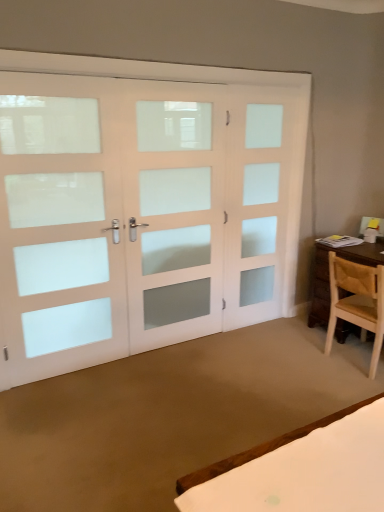
How much space does white frosted glass door at center, placed as the second screen door when sorted from left to right, occupy vertically?

6.43 feet.

What is the approximate height of white frosted glass door at left, positioned as the third screen door in right-to-left order?

white frosted glass door at left, positioned as the third screen door in right-to-left order, is 1.97 meters in height.

What do you see at coordinates (59, 228) in the screenshot? I see `white frosted glass door at left, positioned as the third screen door in right-to-left order` at bounding box center [59, 228].

Locate an element on the screen. The height and width of the screenshot is (512, 384). light brown wooden chair at right is located at coordinates (357, 302).

From a real-world perspective, is white frosted glass door at right, placed as the first screen door when sorted from right to left, below light brown wooden chair at right?

Incorrect, from a real-world perspective, white frosted glass door at right, placed as the first screen door when sorted from right to left, is higher than light brown wooden chair at right.

From the image's perspective, which one is positioned lower, white frosted glass door at right, which appears as the 3th screen door when viewed from the left, or light brown wooden chair at right?

light brown wooden chair at right.

Does white frosted glass door at right, placed as the first screen door when sorted from right to left, have a lesser height compared to light brown wooden chair at right?

No.

Is white frosted glass door at right, which appears as the 3th screen door when viewed from the left, positioned with its back to light brown wooden chair at right?

No, white frosted glass door at right, which appears as the 3th screen door when viewed from the left,'s orientation is not away from light brown wooden chair at right.

Are white frosted glass door at left, the first screen door from the left, and white frosted glass door at right, placed as the first screen door when sorted from right to left, making contact?

They are not placed beside each other.

From the image's perspective, between white frosted glass door at left, the first screen door from the left, and white frosted glass door at right, placed as the first screen door when sorted from right to left, which one is located above?

white frosted glass door at right, placed as the first screen door when sorted from right to left, appears higher in the image.

Between white frosted glass door at left, positioned as the third screen door in right-to-left order, and white frosted glass door at right, which appears as the 3th screen door when viewed from the left, which one has smaller size?

white frosted glass door at right, which appears as the 3th screen door when viewed from the left, is smaller.

Which of these two, white frosted glass door at center, which ranks as the 2th screen door in right-to-left order, or white frosted glass door at right, placed as the first screen door when sorted from right to left, stands taller?

With more height is white frosted glass door at right, placed as the first screen door when sorted from right to left.

Would you say white frosted glass door at right, placed as the first screen door when sorted from right to left, is part of white frosted glass door at center, placed as the second screen door when sorted from left to right,'s contents?

No.

Does white frosted glass door at center, placed as the second screen door when sorted from left to right, have a smaller size compared to white frosted glass door at right, which appears as the 3th screen door when viewed from the left?

Incorrect, white frosted glass door at center, placed as the second screen door when sorted from left to right, is not smaller in size than white frosted glass door at right, which appears as the 3th screen door when viewed from the left.

Image resolution: width=384 pixels, height=512 pixels. There is a white frosted glass door at right, placed as the first screen door when sorted from right to left. In order to click on the 2nd screen door above it (from a real-world perspective) in this screenshot , I will do `click(173, 220)`.

From the picture: In the image, is light brown wooden chair at right positioned in front of or behind white frosted glass door at right, which appears as the 3th screen door when viewed from the left?

light brown wooden chair at right is in front of white frosted glass door at right, which appears as the 3th screen door when viewed from the left.

How many degrees apart are the facing directions of light brown wooden chair at right and white frosted glass door at right, placed as the first screen door when sorted from right to left?

They differ by 92 degrees in their facing directions.

Is light brown wooden chair at right next to white frosted glass door at right, which appears as the 3th screen door when viewed from the left?

No, light brown wooden chair at right is not touching white frosted glass door at right, which appears as the 3th screen door when viewed from the left.

Considering the relative sizes of light brown wooden chair at right and white frosted glass door at right, placed as the first screen door when sorted from right to left, in the image provided, is light brown wooden chair at right smaller than white frosted glass door at right, placed as the first screen door when sorted from right to left,?

Actually, light brown wooden chair at right might be larger than white frosted glass door at right, placed as the first screen door when sorted from right to left.

Locate an element on the screen. The image size is (384, 512). screen door that is the 1st object directly below the white frosted glass door at center, placed as the second screen door when sorted from left to right (from a real-world perspective) is located at coordinates (59, 228).

Is point (0, 213) positioned before point (200, 159)?

Yes, it is.

Is white frosted glass door at left, the first screen door from the left, not inside white frosted glass door at center, which ranks as the 2th screen door in right-to-left order?

Absolutely, white frosted glass door at left, the first screen door from the left, is external to white frosted glass door at center, which ranks as the 2th screen door in right-to-left order.

From the image's perspective, is white frosted glass door at left, positioned as the third screen door in right-to-left order, positioned above or below white frosted glass door at center, which ranks as the 2th screen door in right-to-left order?

Based on their image positions, white frosted glass door at left, positioned as the third screen door in right-to-left order, is located beneath white frosted glass door at center, which ranks as the 2th screen door in right-to-left order.

Looking at their sizes, would you say white frosted glass door at left, the first screen door from the left, is wider or thinner than light brown wooden chair at right?

Clearly, white frosted glass door at left, the first screen door from the left, has less width compared to light brown wooden chair at right.

Is white frosted glass door at left, the first screen door from the left, smaller than light brown wooden chair at right?

No, white frosted glass door at left, the first screen door from the left, is not smaller than light brown wooden chair at right.

Considering the relative positions of white frosted glass door at left, the first screen door from the left, and light brown wooden chair at right in the image provided, is white frosted glass door at left, the first screen door from the left, to the right of light brown wooden chair at right from the viewer's perspective?

No, white frosted glass door at left, the first screen door from the left, is not to the right of light brown wooden chair at right.

Which is in front, point (93, 146) or point (346, 300)?

The point (93, 146) is closer.

How far apart are light brown wooden chair at right and white frosted glass door at center, which ranks as the 2th screen door in right-to-left order?

The distance of light brown wooden chair at right from white frosted glass door at center, which ranks as the 2th screen door in right-to-left order, is 3.92 feet.

Based on the photo, which is more to the left, light brown wooden chair at right or white frosted glass door at center, placed as the second screen door when sorted from left to right?

white frosted glass door at center, placed as the second screen door when sorted from left to right.

From a real-world perspective, is light brown wooden chair at right positioned over white frosted glass door at center, which ranks as the 2th screen door in right-to-left order, based on gravity?

No, from a real-world perspective, light brown wooden chair at right is not above white frosted glass door at center, which ranks as the 2th screen door in right-to-left order.

This screenshot has height=512, width=384. I want to click on screen door behind the light brown wooden chair at right, so click(x=256, y=206).

From the image's perspective, count 2nd screen doors upward from the white frosted glass door at left, the first screen door from the left, and point to it. Please provide its 2D coordinates.

[(256, 206)]

Based on their spatial positions, is light brown wooden chair at right or white frosted glass door at left, the first screen door from the left, further from white frosted glass door at right, which appears as the 3th screen door when viewed from the left?

The object further to white frosted glass door at right, which appears as the 3th screen door when viewed from the left, is white frosted glass door at left, the first screen door from the left.

Based on their spatial positions, is light brown wooden chair at right or white frosted glass door at right, which appears as the 3th screen door when viewed from the left, further from white frosted glass door at center, placed as the second screen door when sorted from left to right?

The object further to white frosted glass door at center, placed as the second screen door when sorted from left to right, is light brown wooden chair at right.

Looking at the image, which one is located closer to white frosted glass door at center, which ranks as the 2th screen door in right-to-left order, light brown wooden chair at right or white frosted glass door at left, positioned as the third screen door in right-to-left order?

white frosted glass door at left, positioned as the third screen door in right-to-left order.

Considering their positions, is white frosted glass door at center, which ranks as the 2th screen door in right-to-left order, positioned further to white frosted glass door at right, which appears as the 3th screen door when viewed from the left, than white frosted glass door at left, positioned as the third screen door in right-to-left order?

white frosted glass door at left, positioned as the third screen door in right-to-left order, is further to white frosted glass door at right, which appears as the 3th screen door when viewed from the left.

From the picture: Which object lies nearer to the anchor point white frosted glass door at left, the first screen door from the left, light brown wooden chair at right or white frosted glass door at right, which appears as the 3th screen door when viewed from the left?

The object closer to white frosted glass door at left, the first screen door from the left, is white frosted glass door at right, which appears as the 3th screen door when viewed from the left.

Looking at the image, which one is located closer to white frosted glass door at right, placed as the first screen door when sorted from right to left, light brown wooden chair at right or white frosted glass door at center, placed as the second screen door when sorted from left to right?

Based on the image, white frosted glass door at center, placed as the second screen door when sorted from left to right, appears to be nearer to white frosted glass door at right, placed as the first screen door when sorted from right to left.

Considering their positions, is white frosted glass door at left, the first screen door from the left, positioned closer to white frosted glass door at center, which ranks as the 2th screen door in right-to-left order, than light brown wooden chair at right?

white frosted glass door at left, the first screen door from the left, is positioned closer to the anchor white frosted glass door at center, which ranks as the 2th screen door in right-to-left order.

Looking at this image, from the image, which object appears to be farther from light brown wooden chair at right, white frosted glass door at left, the first screen door from the left, or white frosted glass door at center, placed as the second screen door when sorted from left to right?

white frosted glass door at left, the first screen door from the left, is further to light brown wooden chair at right.

This screenshot has width=384, height=512. What are the coordinates of `screen door between white frosted glass door at left, positioned as the third screen door in right-to-left order, and white frosted glass door at right, which appears as the 3th screen door when viewed from the left, from left to right` in the screenshot? It's located at (173, 220).

Locate an element on the screen. This screenshot has height=512, width=384. screen door situated between white frosted glass door at center, which ranks as the 2th screen door in right-to-left order, and light brown wooden chair at right from left to right is located at coordinates (256, 206).